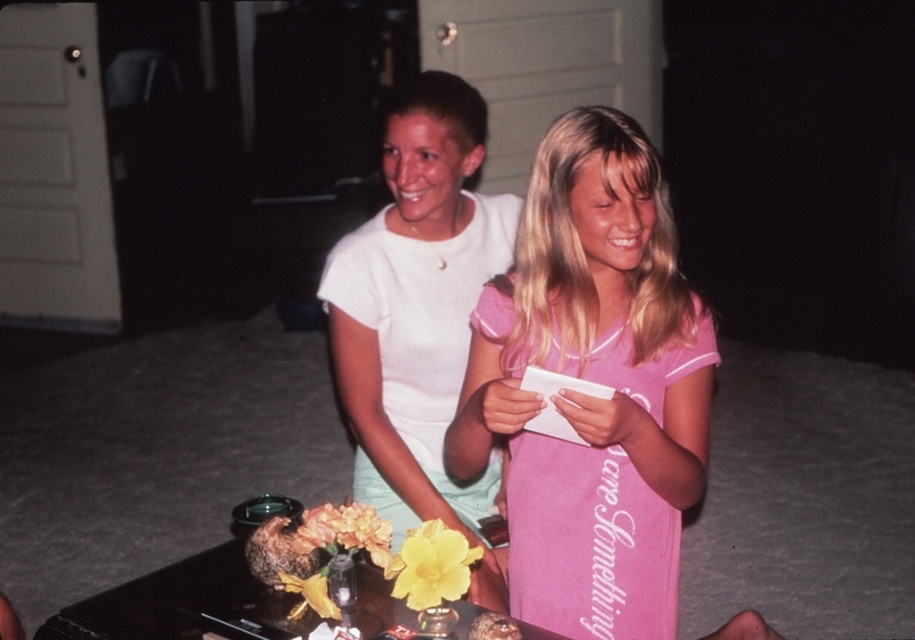
Question: Which object appears farthest from the camera in this image?

Choices:
 (A) black glossy table at lower center
 (B) pink cotton dress at center
 (C) smooth brown bread at lower center

Answer: (A)

Question: Which object is the closest to the black glossy table at lower center?

Choices:
 (A) smooth brown bread at lower center
 (B) white matte shirt at center

Answer: (A)

Question: Does pink cotton dress at center have a smaller size compared to black glossy table at lower center?

Choices:
 (A) yes
 (B) no

Answer: (B)

Question: Does black glossy table at lower center appear on the left side of smooth brown bread at lower center?

Choices:
 (A) yes
 (B) no

Answer: (A)

Question: Can you confirm if white matte shirt at center is wider than smooth brown bread at lower center?

Choices:
 (A) yes
 (B) no

Answer: (A)

Question: Among these objects, which one is farthest from the camera?

Choices:
 (A) pink cotton dress at center
 (B) white matte shirt at center
 (C) smooth brown bread at lower center

Answer: (B)